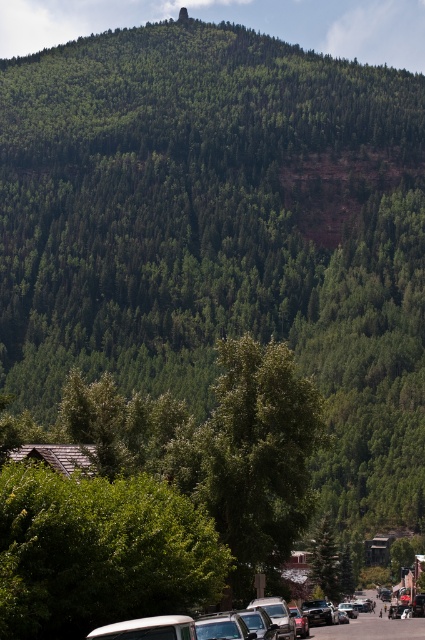
Question: Which point is farther from the camera taking this photo?

Choices:
 (A) (297, 630)
 (B) (124, 573)

Answer: (A)

Question: Is green leafy tree at lower center behind shiny silver sedan at lower center?

Choices:
 (A) yes
 (B) no

Answer: (B)

Question: Is green leafy tree at lower center bigger than shiny silver sedan at lower center?

Choices:
 (A) yes
 (B) no

Answer: (A)

Question: Can you confirm if green leafy tree at lower center is positioned below shiny silver sedan at lower center?

Choices:
 (A) yes
 (B) no

Answer: (B)

Question: Which object is farther from the camera taking this photo?

Choices:
 (A) green leafy tree at lower center
 (B) shiny silver sedan at lower center

Answer: (B)

Question: Which point is farther from the camera taking this photo?

Choices:
 (A) (11, 509)
 (B) (294, 614)

Answer: (B)